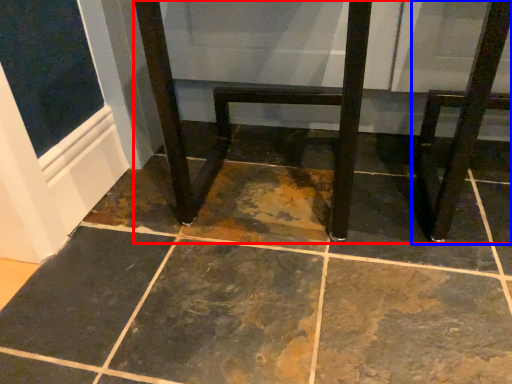
Question: Which point is further to the camera, furniture (highlighted by a red box) or step stool (highlighted by a blue box)?

Choices:
 (A) furniture
 (B) step stool

Answer: (A)